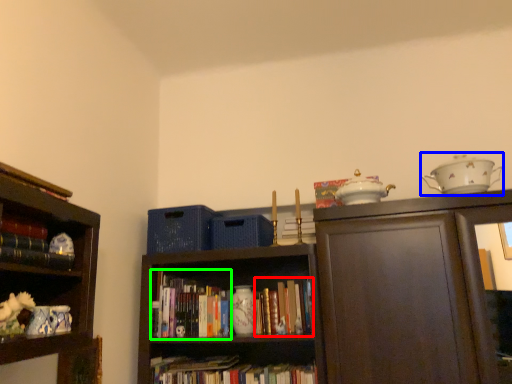
Question: Estimate the real-world distances between objects in this image. Which object is closer to book (highlighted by a red box), tea set (highlighted by a blue box) or book (highlighted by a green box)?

Choices:
 (A) tea set
 (B) book

Answer: (B)